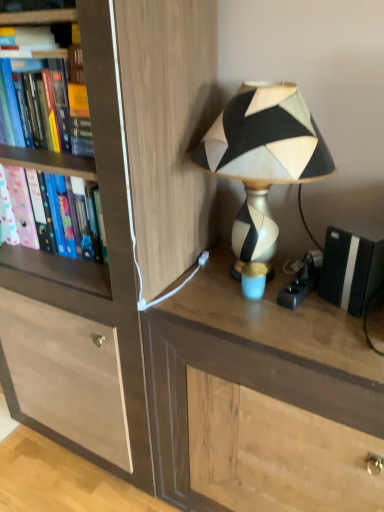
Question: Should I look upward or downward to see brown wood desk at center?

Choices:
 (A) down
 (B) up

Answer: (A)

Question: Would you consider pink matte folder at left, the second book when ordered from top to bottom, to be distant from black matte speaker at right?

Choices:
 (A) no
 (B) yes

Answer: (A)

Question: Does pink matte folder at left, the second book when ordered from top to bottom, lie behind black matte speaker at right?

Choices:
 (A) no
 (B) yes

Answer: (B)

Question: From a real-world perspective, does pink matte folder at left, the 1th book when ordered from bottom to top, sit lower than black matte speaker at right?

Choices:
 (A) no
 (B) yes

Answer: (A)

Question: Can you confirm if pink matte folder at left, the 1th book when ordered from bottom to top, is positioned to the left of black matte speaker at right?

Choices:
 (A) yes
 (B) no

Answer: (A)

Question: From the image's perspective, is pink matte folder at left, the 1th book when ordered from bottom to top, below black matte speaker at right?

Choices:
 (A) yes
 (B) no

Answer: (B)

Question: Is black matte speaker at right surrounded by pink matte folder at left, the 1th book when ordered from bottom to top?

Choices:
 (A) yes
 (B) no

Answer: (B)

Question: Is brown wood desk at center at the left side of black matte speaker at right?

Choices:
 (A) yes
 (B) no

Answer: (A)

Question: Is brown wood desk at center at the right side of black matte speaker at right?

Choices:
 (A) yes
 (B) no

Answer: (B)

Question: From the image's perspective, is brown wood desk at center beneath black matte speaker at right?

Choices:
 (A) no
 (B) yes

Answer: (B)

Question: From the image's perspective, would you say brown wood desk at center is positioned over black matte speaker at right?

Choices:
 (A) no
 (B) yes

Answer: (A)

Question: Is brown wood desk at center positioned in front of black matte speaker at right?

Choices:
 (A) yes
 (B) no

Answer: (A)

Question: Could black matte speaker at right be considered to be inside brown wood desk at center?

Choices:
 (A) yes
 (B) no

Answer: (B)

Question: Does black and white geometric lampshade at upper right come in front of pink matte folder at left, the second book when ordered from top to bottom?

Choices:
 (A) no
 (B) yes

Answer: (B)